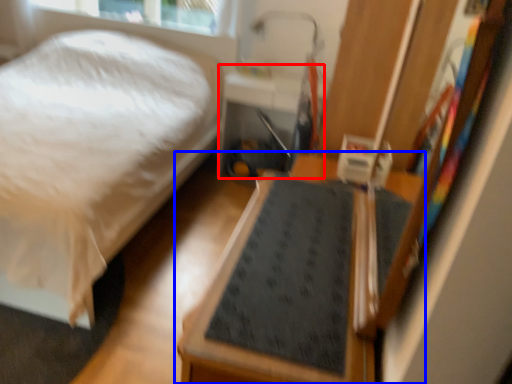
Question: Which object appears closest to the camera in this image, table (highlighted by a red box) or furniture (highlighted by a blue box)?

Choices:
 (A) table
 (B) furniture

Answer: (B)